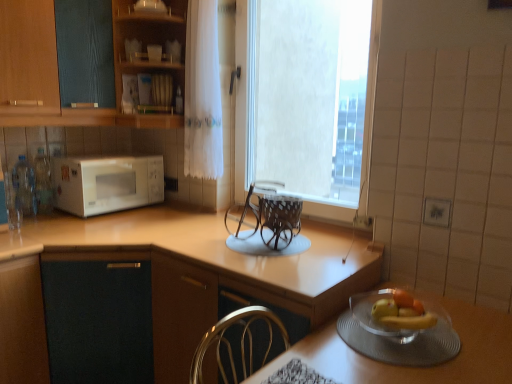
I want to click on vacant space underneath wooden shelves at upper center, the second cabinetry from the left (from a real-world perspective), so click(170, 209).